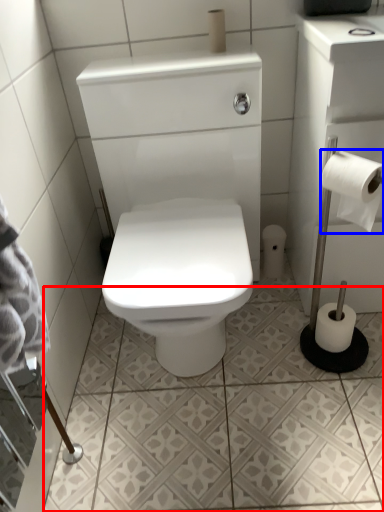
Question: Which object is closer to the camera taking this photo, ceramic tile (highlighted by a red box) or toilet paper (highlighted by a blue box)?

Choices:
 (A) ceramic tile
 (B) toilet paper

Answer: (B)